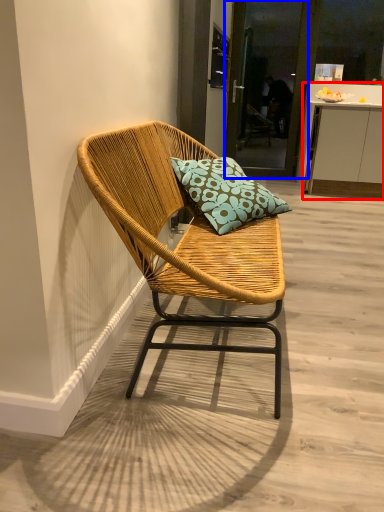
Question: Which object is closer to the camera taking this photo, cabinetry (highlighted by a red box) or screen door (highlighted by a blue box)?

Choices:
 (A) cabinetry
 (B) screen door

Answer: (A)